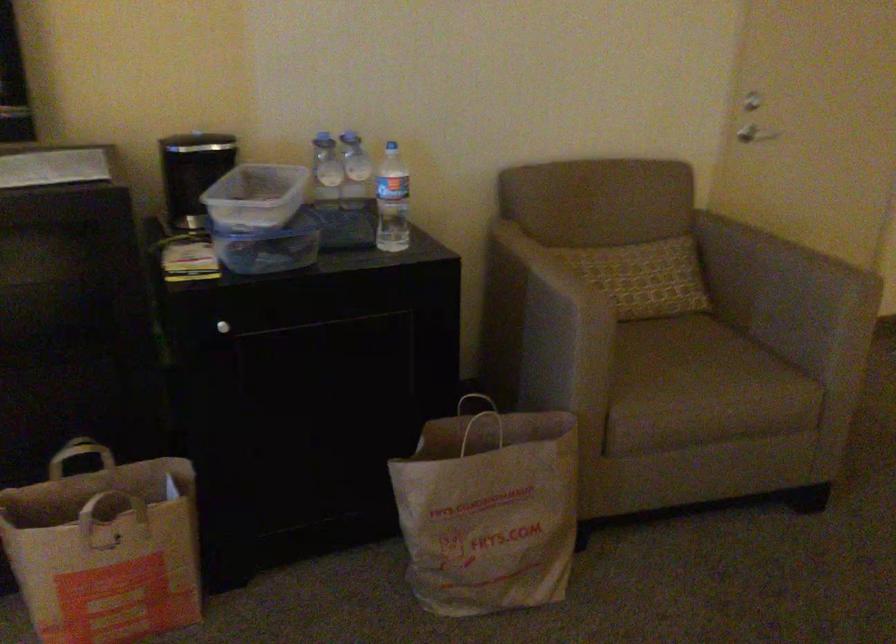
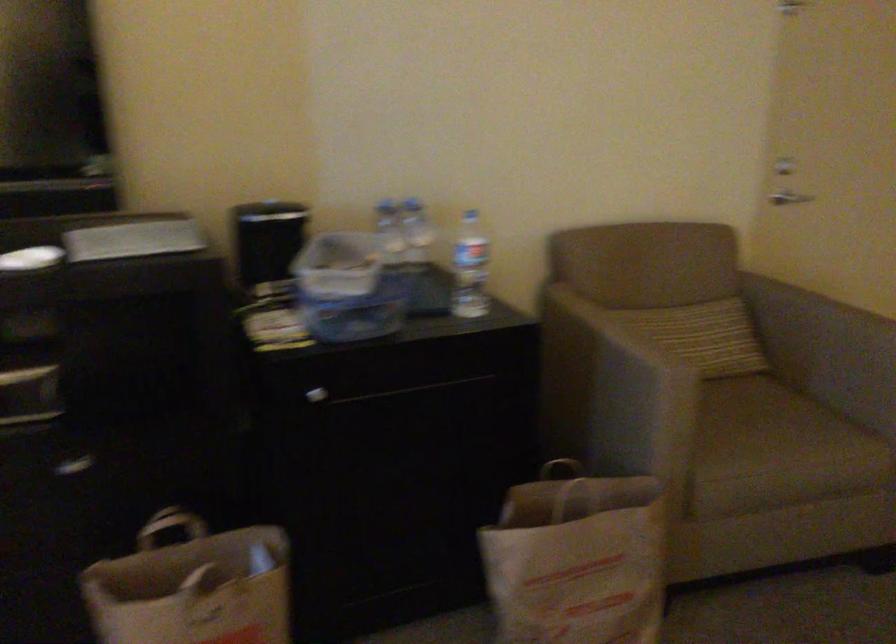
Locate, in the second image, the point that corresponds to the point at 225,325 in the first image.

(316, 395)